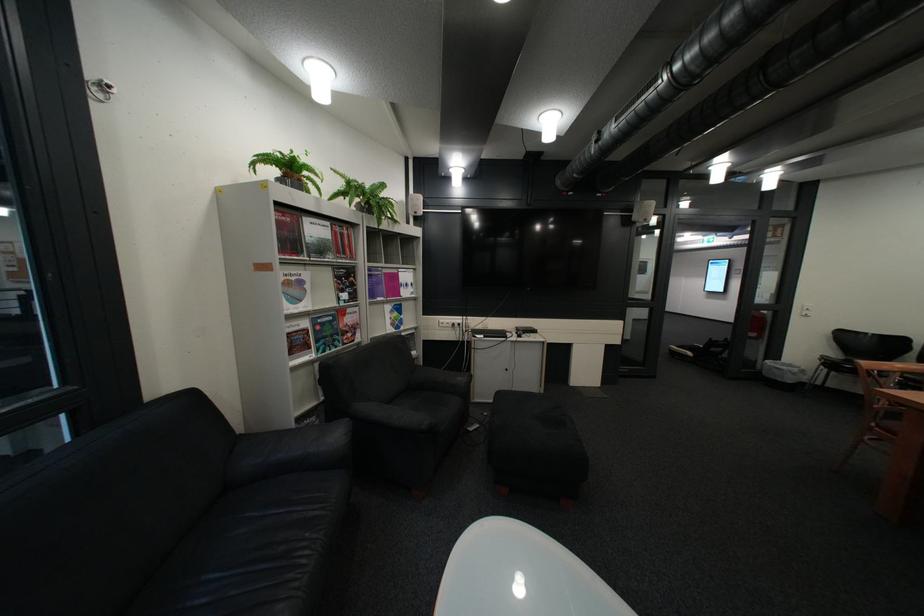
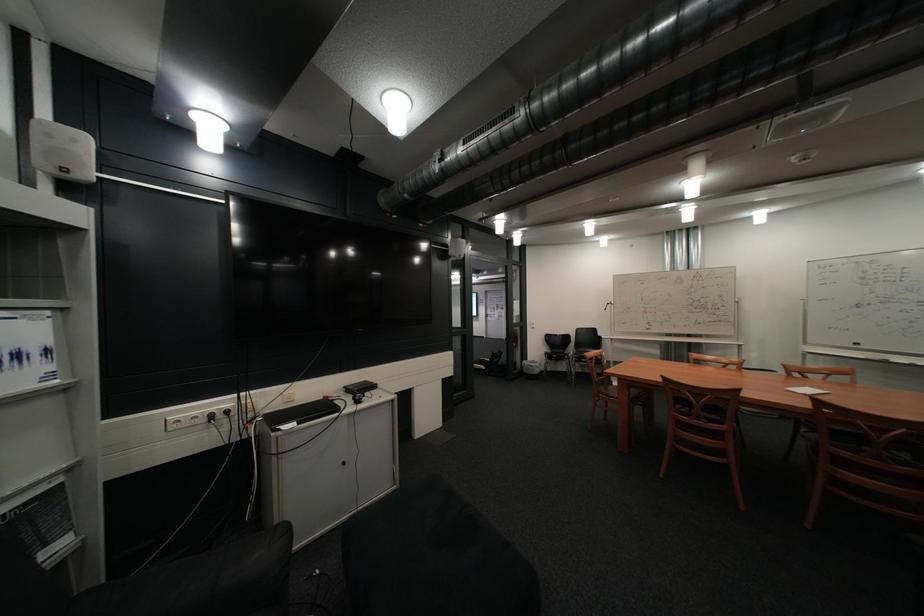
The point at (x=424, y=296) is marked in the first image. Where is the corresponding point in the second image?

(46, 386)